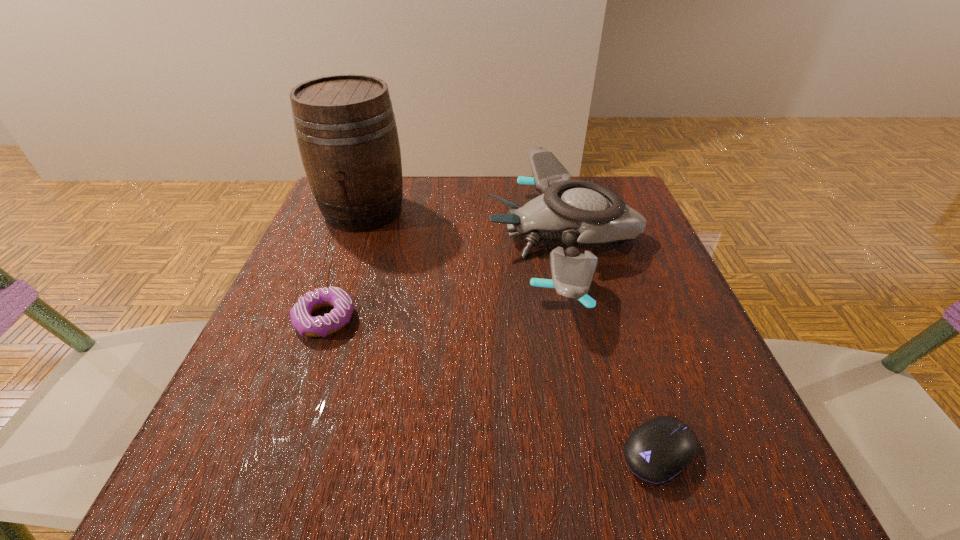
Find the location of a particular element. The image size is (960, 540). vacant position in the image that satisfies the following two spatial constraints: 1. on the front-facing side of the drone; 2. on the back side of the nearest object is located at coordinates (617, 453).

The height and width of the screenshot is (540, 960). What are the coordinates of `free space that satisfies the following two spatial constraints: 1. on the front-facing side of the computer mouse; 2. on the right side of the drone` in the screenshot? It's located at (617, 453).

The height and width of the screenshot is (540, 960). Identify the location of vacant space that satisfies the following two spatial constraints: 1. on the front-facing side of the drone; 2. on the left side of the nearest object. (617, 453).

This screenshot has width=960, height=540. I want to click on vacant space that satisfies the following two spatial constraints: 1. on the side of the doughnut near the bung hole; 2. on the right side of the tallest object, so click(x=324, y=319).

Locate an element on the screen. vacant space that satisfies the following two spatial constraints: 1. on the side of the tallest object near the bung hole; 2. on the left side of the computer mouse is located at coordinates (276, 453).

This screenshot has width=960, height=540. What are the coordinates of `free space in the image that satisfies the following two spatial constraints: 1. on the side of the nearest object near the bung hole; 2. on the right side of the tallest object` in the screenshot? It's located at (276, 453).

Locate an element on the screen. free space that satisfies the following two spatial constraints: 1. on the side of the cider near the bung hole; 2. on the left side of the doughnut is located at coordinates (324, 319).